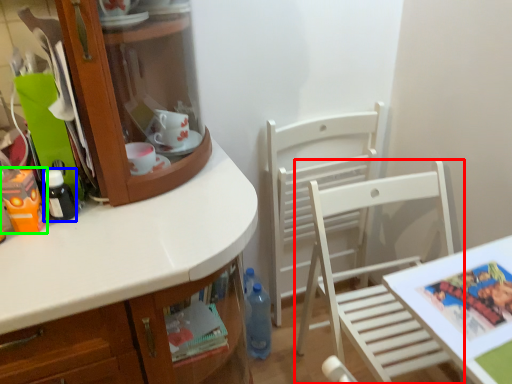
Question: Which object is positioned closest to chair (highlighted by a red box)? Select from bottle (highlighted by a blue box) and toy (highlighted by a green box).

Choices:
 (A) bottle
 (B) toy

Answer: (A)